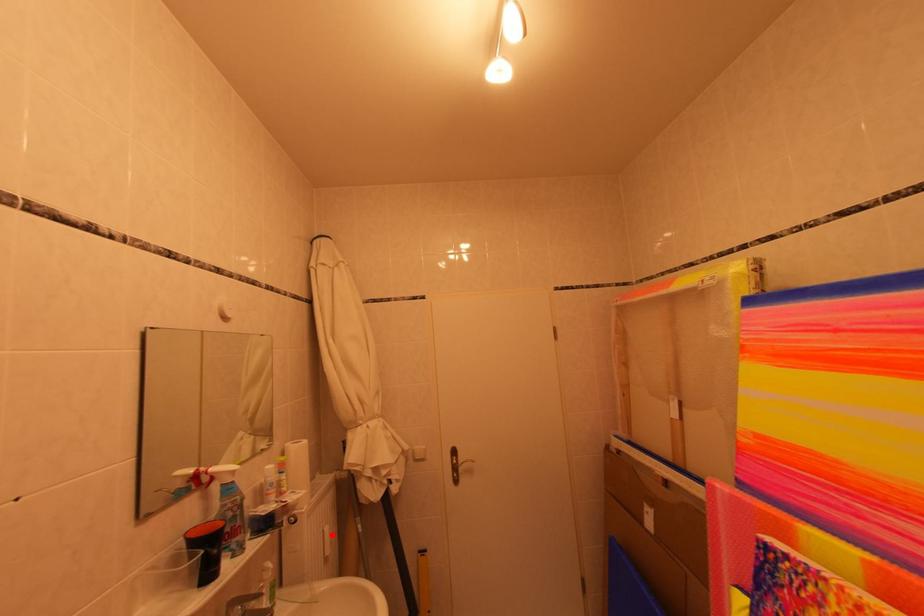
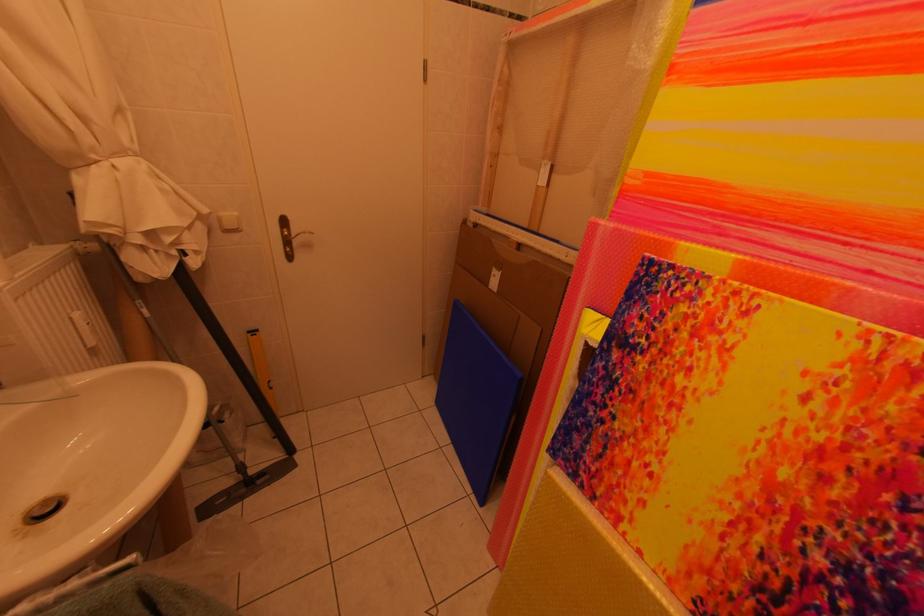
Question: A red point is marked in image1. In image2, is the corresponding 3D point closer to the camera or farther? Reply with the corresponding letter.

Choices:
 (A) The corresponding 3D point is closer.
 (B) The corresponding 3D point is farther.

Answer: (B)